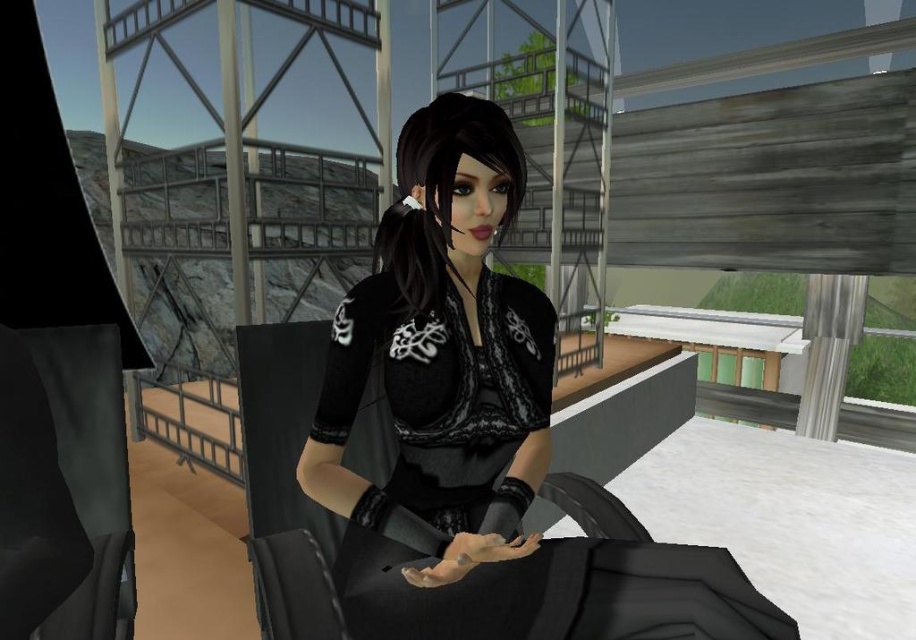
Question: Does black satin dress at center have a smaller size compared to black lace dress at center?

Choices:
 (A) yes
 (B) no

Answer: (B)

Question: From the image, what is the correct spatial relationship of black satin dress at center in relation to black lace dress at center?

Choices:
 (A) above
 (B) below

Answer: (A)

Question: Among these objects, which one is farthest from the camera?

Choices:
 (A) black satin dress at center
 (B) black lace dress at center

Answer: (B)

Question: Is black satin dress at center positioned before black lace dress at center?

Choices:
 (A) yes
 (B) no

Answer: (A)